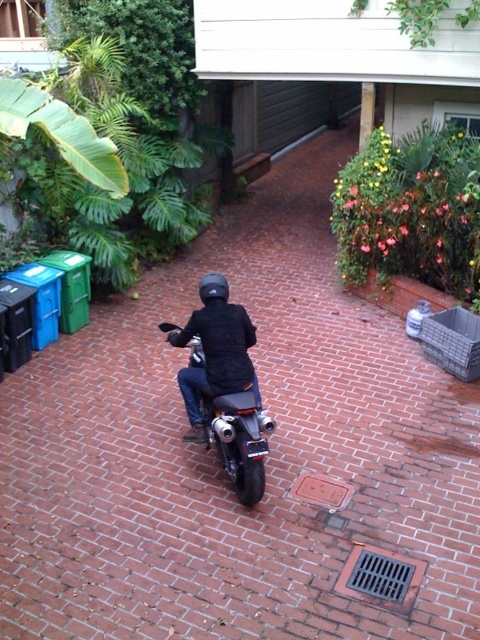
Question: Is black leather jacket at center to the left of shiny chrome motorcycle at center from the viewer's perspective?

Choices:
 (A) yes
 (B) no

Answer: (A)

Question: Observing the image, what is the correct spatial positioning of black leather jacket at center in reference to shiny chrome motorcycle at center?

Choices:
 (A) below
 (B) above

Answer: (B)

Question: Which point appears farthest from the camera in this image?

Choices:
 (A) (255, 381)
 (B) (190, 360)

Answer: (B)

Question: Can you confirm if black leather jacket at center is thinner than shiny chrome motorcycle at center?

Choices:
 (A) yes
 (B) no

Answer: (B)

Question: Which of the following is the farthest from the observer?

Choices:
 (A) (204, 336)
 (B) (259, 452)

Answer: (A)